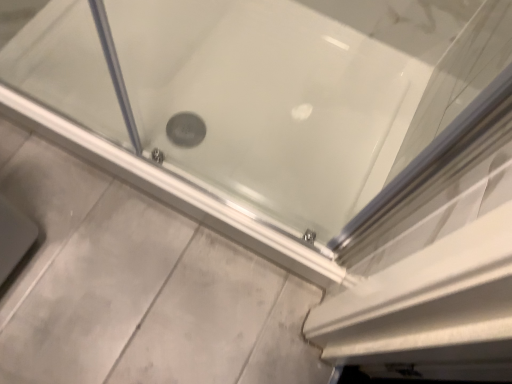
This screenshot has width=512, height=384. What are the coordinates of `free space above white matte concrete at lower center (from a real-world perspective)` in the screenshot? It's located at (132, 284).